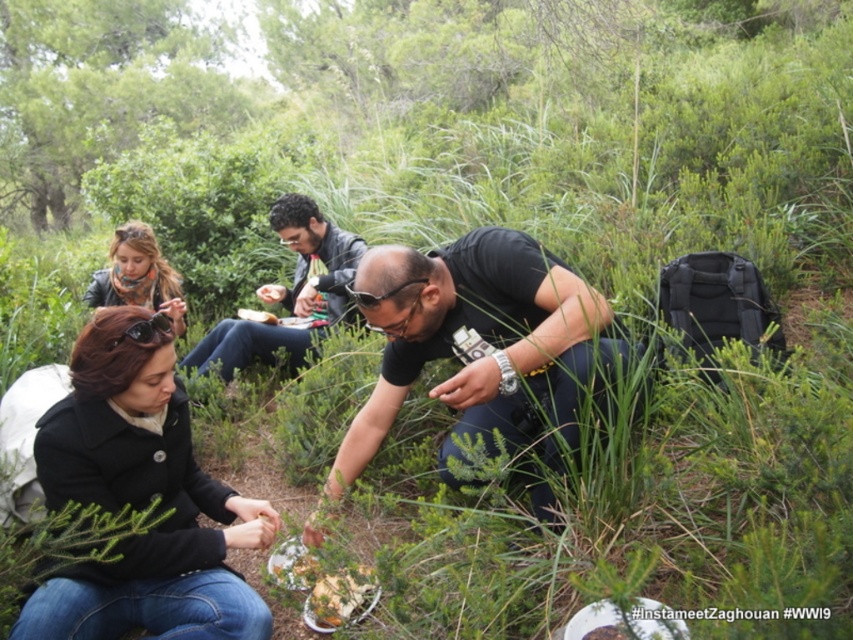
Question: Where is matte black jacket at center located in relation to leather jacket at upper left in the image?

Choices:
 (A) left
 (B) right

Answer: (B)

Question: Can you confirm if black matte shirt at center is positioned above leather jacket at upper left?

Choices:
 (A) no
 (B) yes

Answer: (A)

Question: Which point is farther to the camera?

Choices:
 (A) white matte bread at center
 (B) black matte coat at lower left

Answer: (A)

Question: Among these objects, which one is farthest from the camera?

Choices:
 (A) black matte shirt at center
 (B) black matte coat at lower left
 (C) matte black jacket at center
 (D) white matte bread at center

Answer: (D)

Question: Is black matte coat at lower left positioned before matte black jacket at center?

Choices:
 (A) yes
 (B) no

Answer: (A)

Question: Considering the real-world distances, which object is closest to the black matte coat at lower left?

Choices:
 (A) black matte shirt at center
 (B) white matte bread at center

Answer: (A)